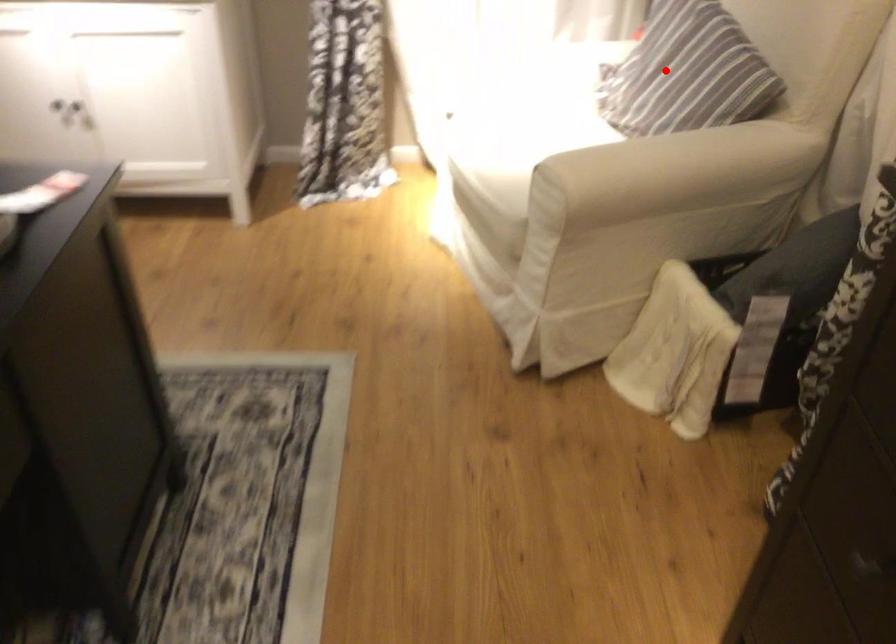
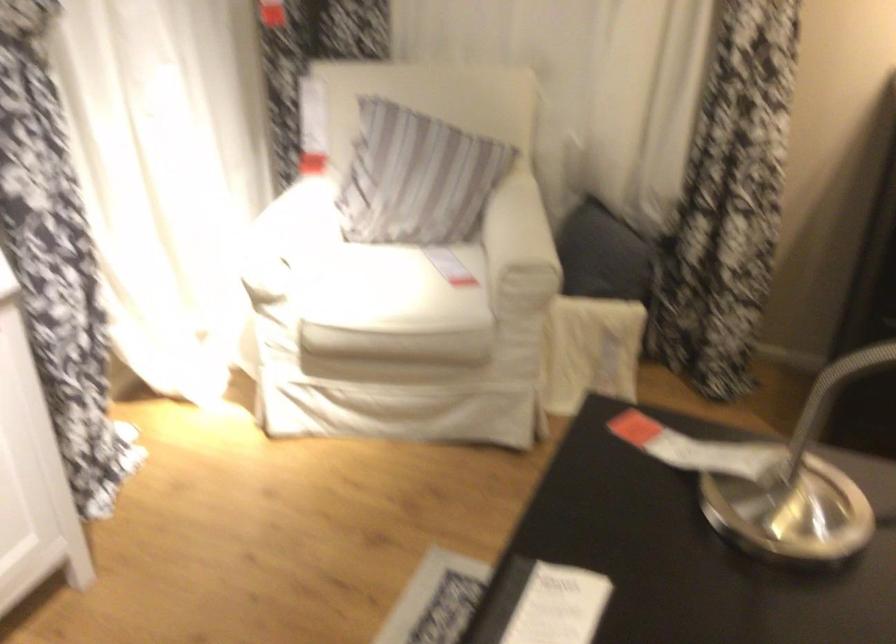
Question: I am providing you with two images of the same scene from different viewpoints. Image1 has a red point marked. In image2, the corresponding 3D location appears at what relative position? Reply with the corresponding letter.

Choices:
 (A) Closer
 (B) Farther

Answer: (B)